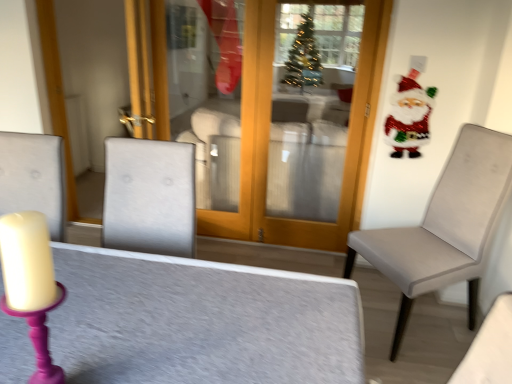
Question: Based on their sizes in the image, would you say textured gray table at center is bigger or smaller than shiny sequined santa at upper right?

Choices:
 (A) small
 (B) big

Answer: (B)

Question: Visually, is textured gray table at center positioned to the left or to the right of shiny sequined santa at upper right?

Choices:
 (A) right
 (B) left

Answer: (B)

Question: Which object is positioned closest to the shiny sequined santa at upper right?

Choices:
 (A) matte gray chair at right
 (B) textured gray table at center

Answer: (A)

Question: Which object is the farthest from the textured gray table at center?

Choices:
 (A) matte gray chair at right
 (B) shiny sequined santa at upper right

Answer: (B)